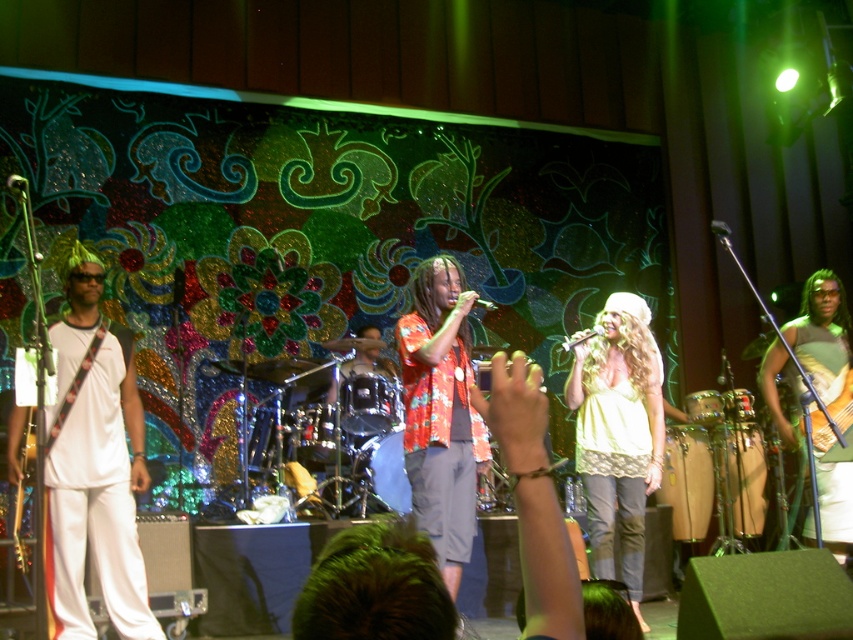
Question: Which point is farther to the camera?

Choices:
 (A) white matte guitar at left
 (B) light yellow fabric shirt at center
 (C) green fabric guitar at center

Answer: (B)

Question: Which object is closer to the camera taking this photo?

Choices:
 (A) light yellow fabric shirt at center
 (B) white matte guitar at left

Answer: (B)

Question: Is white matte guitar at left positioned at the back of green fabric guitar at center?

Choices:
 (A) yes
 (B) no

Answer: (B)

Question: Is white matte guitar at left wider than green fabric guitar at center?

Choices:
 (A) no
 (B) yes

Answer: (B)

Question: Estimate the real-world distances between objects in this image. Which object is closer to the white matte guitar at left?

Choices:
 (A) light yellow fabric shirt at center
 (B) green fabric guitar at center

Answer: (A)

Question: Is white matte guitar at left to the right of light yellow fabric shirt at center from the viewer's perspective?

Choices:
 (A) no
 (B) yes

Answer: (A)